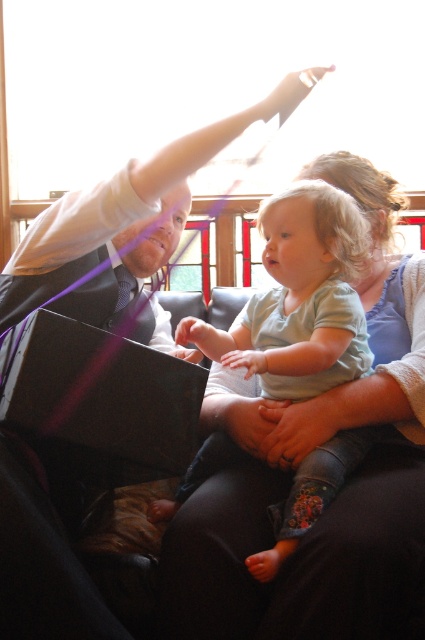
Question: Does matte black suit at upper left appear over matte black laptop at lower left?

Choices:
 (A) no
 (B) yes

Answer: (B)

Question: Which of these objects is positioned closest to the matte black laptop at lower left?

Choices:
 (A) light green cotton shirt at center
 (B) matte black suit at upper left

Answer: (B)

Question: Which is nearer to the matte black suit at upper left?

Choices:
 (A) matte black laptop at lower left
 (B) light green cotton shirt at center

Answer: (A)

Question: Does matte black suit at upper left appear on the left side of matte black laptop at lower left?

Choices:
 (A) no
 (B) yes

Answer: (A)

Question: Considering the relative positions of light green cotton shirt at center and matte black laptop at lower left in the image provided, where is light green cotton shirt at center located with respect to matte black laptop at lower left?

Choices:
 (A) below
 (B) above

Answer: (B)

Question: Which point is farther to the camera?

Choices:
 (A) [68, 634]
 (B) [189, 445]
 (C) [351, 300]

Answer: (C)